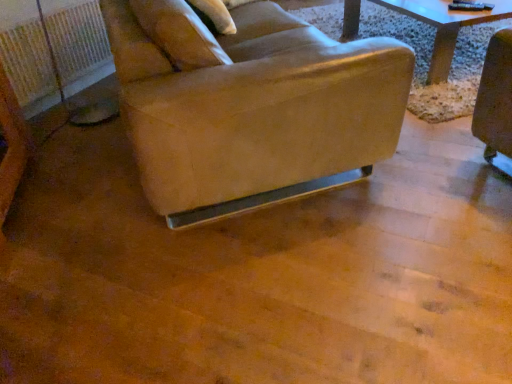
Question: Does point (23, 64) appear closer or farther from the camera than point (335, 109)?

Choices:
 (A) closer
 (B) farther

Answer: (B)

Question: Looking at the image, does white plastic radiator at left seem bigger or smaller compared to leather-like beige chair at center?

Choices:
 (A) big
 (B) small

Answer: (B)

Question: Which is farther from the beige fabric pillow at upper center?

Choices:
 (A) white plastic radiator at left
 (B) leather-like beige chair at center

Answer: (A)

Question: Estimate the real-world distances between objects in this image. Which object is closer to the beige fabric pillow at upper center?

Choices:
 (A) white plastic radiator at left
 (B) leather-like beige chair at center

Answer: (B)